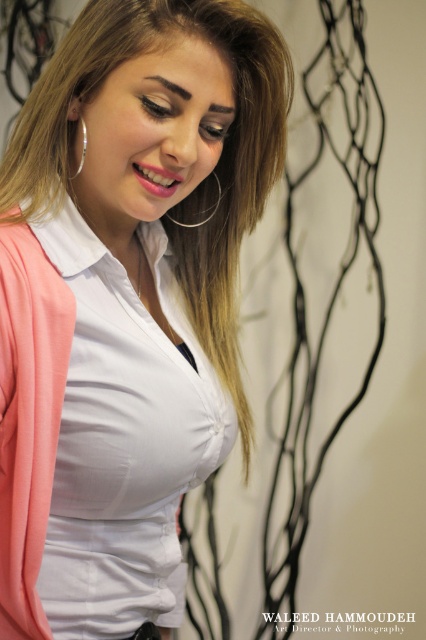
Question: Does white matte shirt at center appear over silver metallic hoop at upper left?

Choices:
 (A) yes
 (B) no

Answer: (B)

Question: Which object appears closest to the camera in this image?

Choices:
 (A) silver metallic hoop at upper left
 (B) white matte shirt at center

Answer: (B)

Question: In this image, where is white matte shirt at center located relative to silver metallic hoop at upper left?

Choices:
 (A) left
 (B) right

Answer: (B)

Question: Which of the following is the farthest from the observer?

Choices:
 (A) [x=83, y=163]
 (B) [x=109, y=344]

Answer: (A)

Question: Among these points, which one is nearest to the camera?

Choices:
 (A) (186, 442)
 (B) (83, 129)

Answer: (B)

Question: Can you confirm if white matte shirt at center is wider than silver metallic hoop at upper left?

Choices:
 (A) yes
 (B) no

Answer: (A)